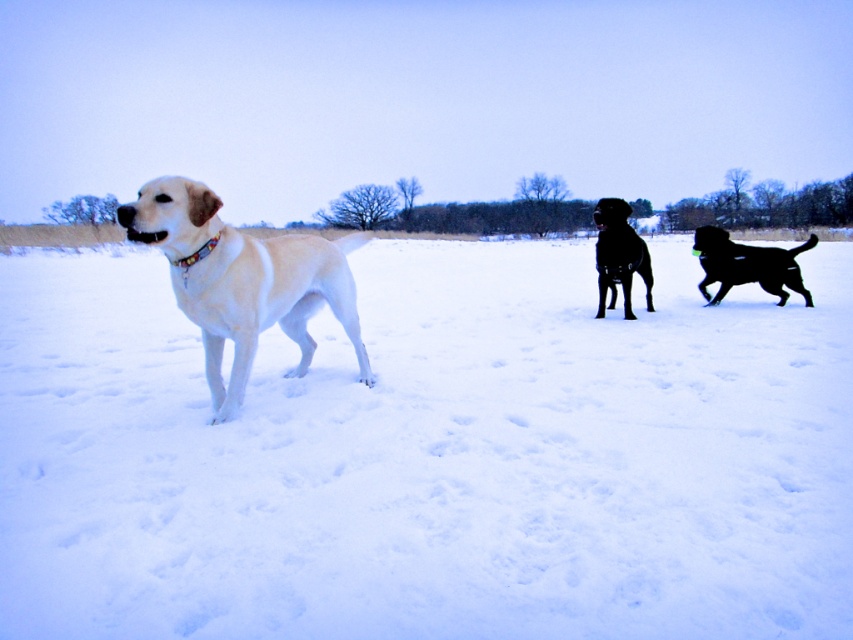
Question: Can you confirm if white fluffy snow at center is thinner than shiny golden retriever at left?

Choices:
 (A) no
 (B) yes

Answer: (A)

Question: Is shiny golden retriever at left in front of shiny black dog at center?

Choices:
 (A) yes
 (B) no

Answer: (A)

Question: Can you confirm if white fluffy snow at center is wider than shiny black dog at center?

Choices:
 (A) yes
 (B) no

Answer: (A)

Question: Which of the following is the farthest from the observer?

Choices:
 (A) shiny black dog at center
 (B) shiny black dog at right
 (C) white fluffy snow at center
 (D) shiny golden retriever at left

Answer: (B)

Question: Which point is farther to the camera?

Choices:
 (A) (639, 394)
 (B) (207, 298)
 (C) (775, 282)

Answer: (C)

Question: Based on their relative distances, which object is nearer to the shiny golden retriever at left?

Choices:
 (A) shiny black dog at center
 (B) shiny black dog at right

Answer: (A)